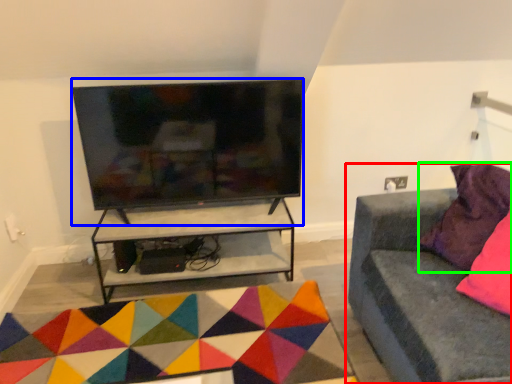
Question: Which is farther away from studio couch (highlighted by a red box)? television (highlighted by a blue box) or pillow (highlighted by a green box)?

Choices:
 (A) television
 (B) pillow

Answer: (A)